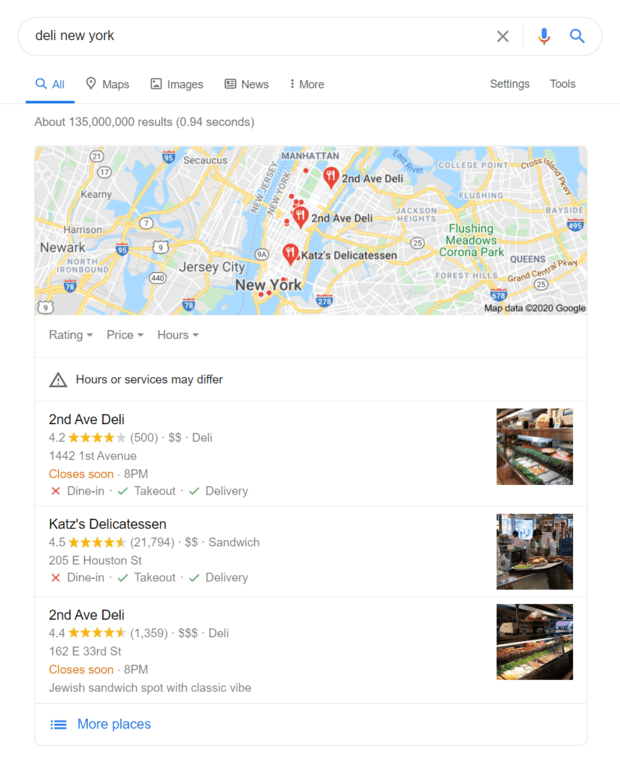
Where is `mic`? The height and width of the screenshot is (760, 620). mic is located at coordinates (539, 30).